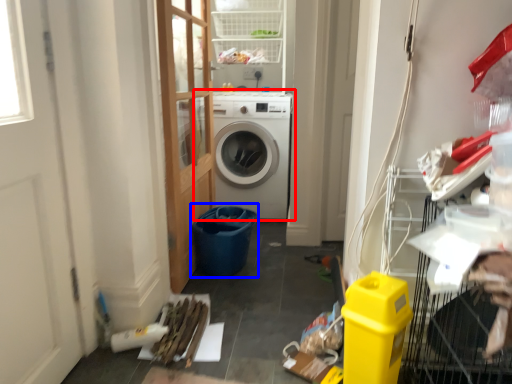
Question: Which of the following is the closest to the observer, washing machine (highlighted by a red box) or recycling bin (highlighted by a blue box)?

Choices:
 (A) washing machine
 (B) recycling bin

Answer: (B)